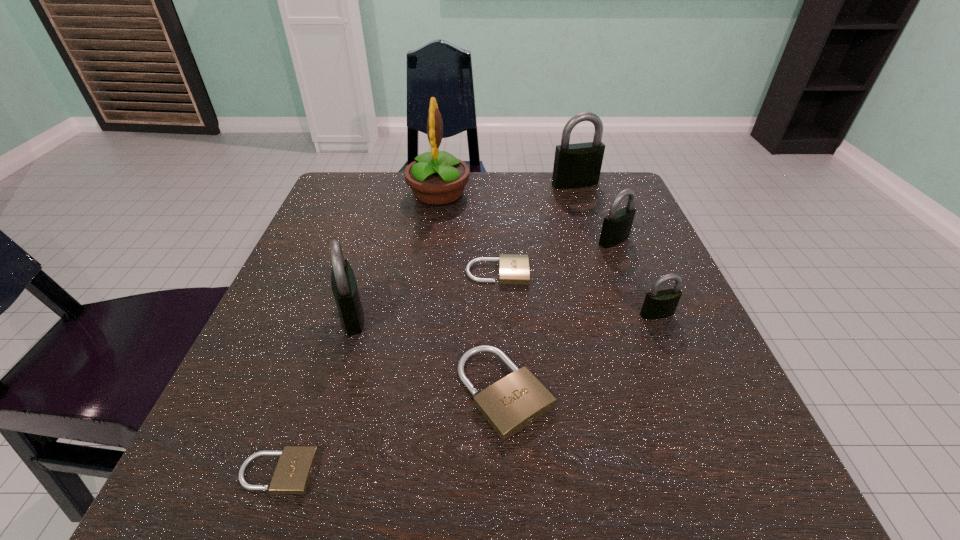
Where is `vacant space located on the front of the fourth shortest padlock`? vacant space located on the front of the fourth shortest padlock is located at coordinates [669, 342].

What are the coordinates of `free point located on the left of the sixth tallest object` in the screenshot? It's located at (416, 393).

Image resolution: width=960 pixels, height=540 pixels. What are the coordinates of `vacant space situated 0.150m on the right of the second biggest beige padlock` in the screenshot? It's located at (608, 273).

Find the location of a particular element. The height and width of the screenshot is (540, 960). free location located on the right of the nearest object is located at coordinates (x=465, y=472).

This screenshot has height=540, width=960. I want to click on sunflower at the far edge, so click(x=437, y=178).

The height and width of the screenshot is (540, 960). Identify the location of padlock located at the far edge. (578, 165).

Locate an element on the screen. The height and width of the screenshot is (540, 960). object at the near left corner is located at coordinates (292, 475).

Locate an element on the screen. object that is at the far right corner is located at coordinates pos(578,165).

In the image, there is a desktop. At what (x,y) coordinates should I click in order to perform the action: click on vacant space at the far edge. Please return your answer as a coordinate pair (x, y). Looking at the image, I should click on (474, 181).

In the image, there is a desktop. At what (x,y) coordinates should I click in order to perform the action: click on vacant region at the near edge. Please return your answer as a coordinate pair (x, y). The width and height of the screenshot is (960, 540). Looking at the image, I should click on (588, 468).